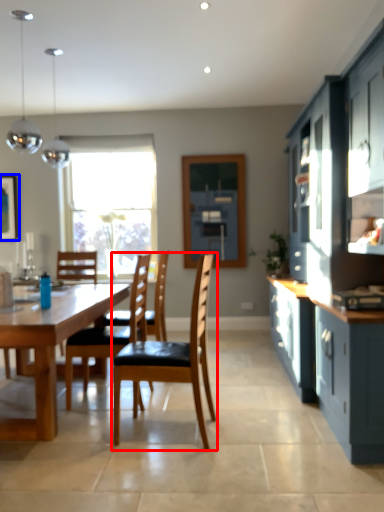
Question: Which object is further to the camera taking this photo, chair (highlighted by a red box) or picture frame (highlighted by a blue box)?

Choices:
 (A) chair
 (B) picture frame

Answer: (B)